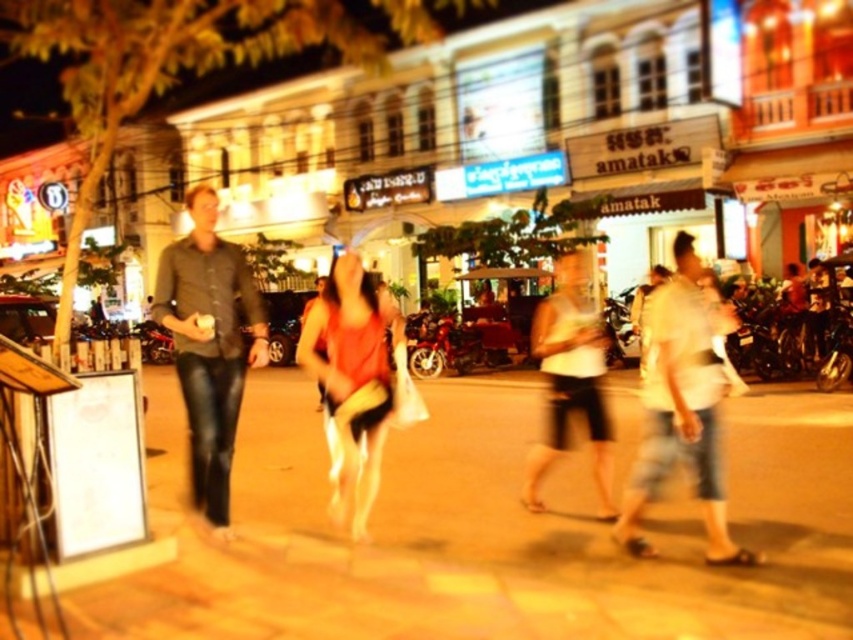
Question: Can you confirm if brown stone pavement at center is wider than matte black shirt at left?

Choices:
 (A) yes
 (B) no

Answer: (A)

Question: Is matte black shirt at left wider than white cotton shirt at center?

Choices:
 (A) yes
 (B) no

Answer: (A)

Question: Which object is the closest to the white cotton shirt at center?

Choices:
 (A) white matte shorts at center
 (B) matte black shirt at left
 (C) brown stone pavement at center
 (D) matte orange tank top at center

Answer: (D)

Question: Considering the relative positions of white cotton shirt at center and matte orange tank top at center in the image provided, where is white cotton shirt at center located with respect to matte orange tank top at center?

Choices:
 (A) below
 (B) above

Answer: (A)

Question: Which point is farther from the camera taking this photo?

Choices:
 (A) (352, 532)
 (B) (485, 396)
 (C) (547, 442)
 (D) (235, 330)

Answer: (B)

Question: Which point appears farthest from the camera in this image?

Choices:
 (A) (585, 358)
 (B) (233, 509)
 (C) (178, 376)

Answer: (B)